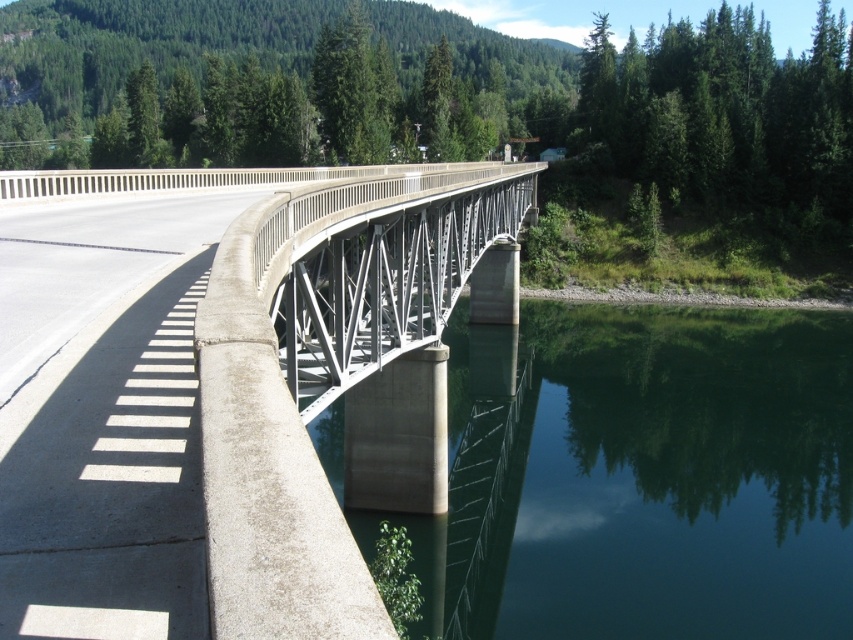
Question: Does green smooth water at lower center have a greater width compared to metallic gray bridge at center?

Choices:
 (A) no
 (B) yes

Answer: (B)

Question: Can you confirm if green smooth water at lower center is positioned below metallic gray bridge at center?

Choices:
 (A) yes
 (B) no

Answer: (A)

Question: Does green smooth water at lower center have a lesser width compared to metallic gray bridge at center?

Choices:
 (A) yes
 (B) no

Answer: (B)

Question: Which of the following is the closest to the observer?

Choices:
 (A) green smooth water at lower center
 (B) metallic gray bridge at center

Answer: (B)

Question: Which point appears farthest from the camera in this image?

Choices:
 (A) coord(521,170)
 (B) coord(805,627)

Answer: (A)